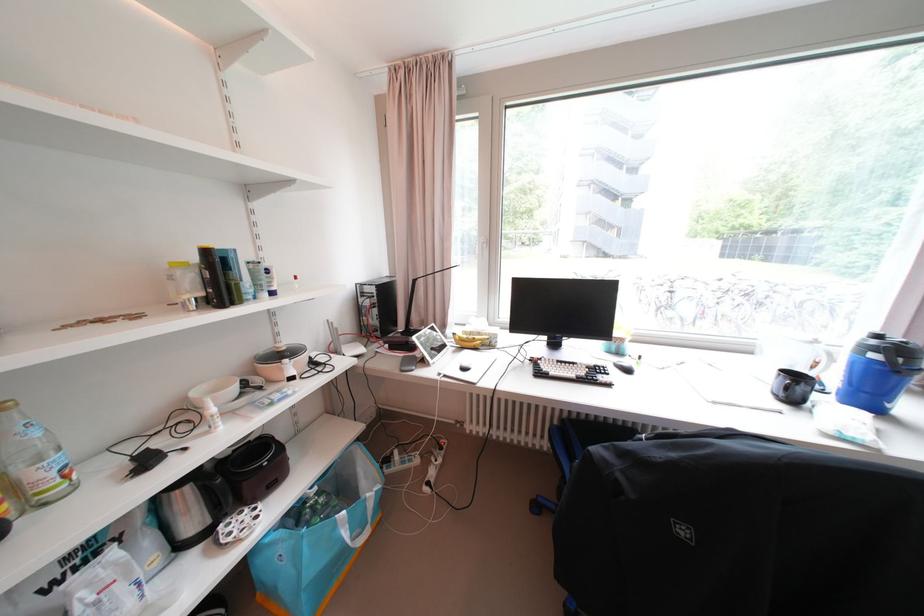
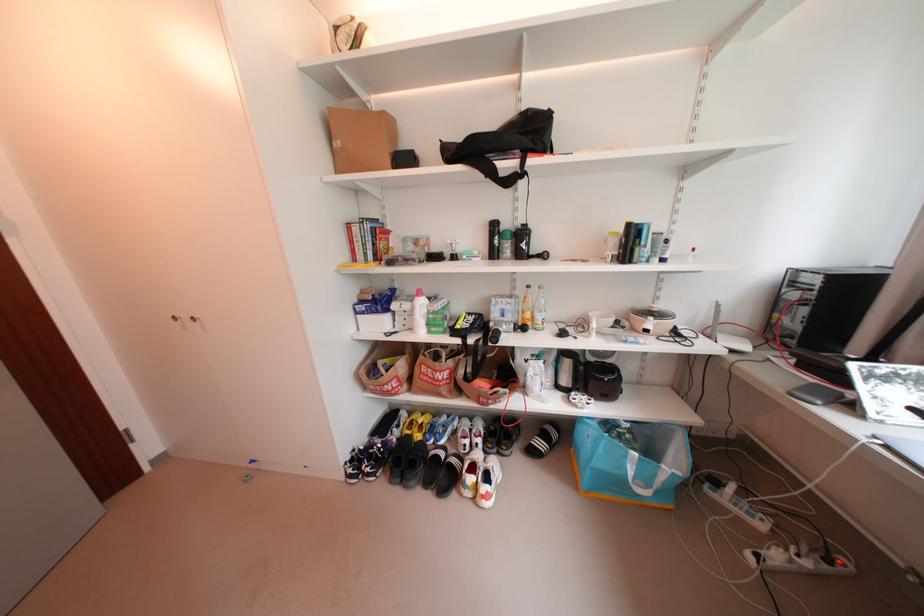
Locate, in the second image, the point that corresponds to pixel 213 554 in the first image.

(572, 399)